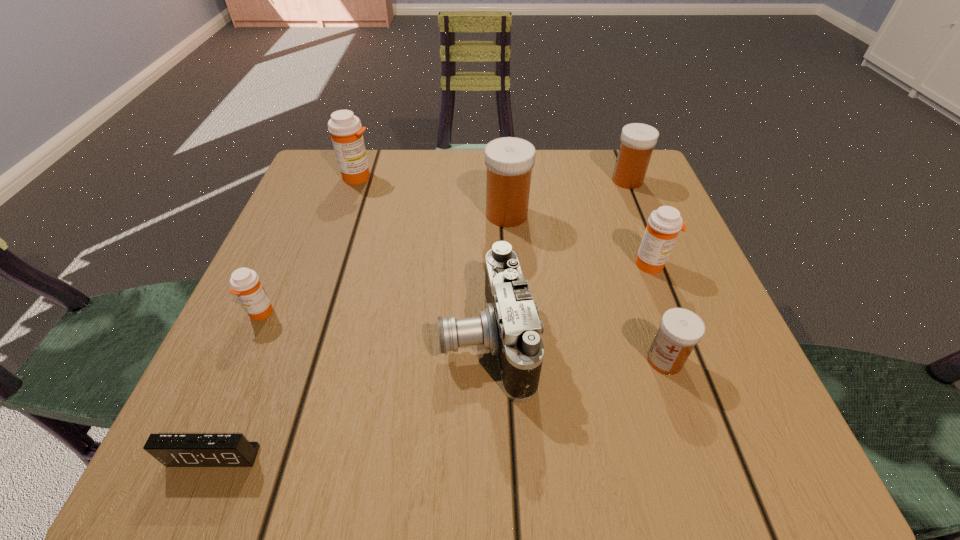
The height and width of the screenshot is (540, 960). In order to click on free space that is in between the leftmost white medicine and the second orange medicine from left to right in this screenshot , I will do `click(433, 195)`.

Find the location of a particular element. The height and width of the screenshot is (540, 960). the seventh closest object relative to the third farthest medicine is located at coordinates (172, 450).

Identify which object is the fourth nearest to the nearest object. Please provide its 2D coordinates. Your answer should be formatted as a tuple, i.e. [(x, y)], where the tuple contains the x and y coordinates of a point satisfying the conditions above.

[(680, 330)]

Identify which medicine is located as the nearest to the nearest medicine. Please provide its 2D coordinates. Your answer should be formatted as a tuple, i.e. [(x, y)], where the tuple contains the x and y coordinates of a point satisfying the conditions above.

[(663, 226)]

The height and width of the screenshot is (540, 960). I want to click on medicine that is the second closest one to the nearest orange medicine, so click(509, 160).

At what (x,y) coordinates should I click in order to perform the action: click on the second closest orange medicine relative to the third nearest medicine. Please return your answer as a coordinate pair (x, y). Looking at the image, I should click on (245, 283).

At what (x,y) coordinates should I click in order to perform the action: click on orange medicine that is the closest to the farthest white medicine. Please return your answer as a coordinate pair (x, y). The width and height of the screenshot is (960, 540). Looking at the image, I should click on (663, 226).

The image size is (960, 540). What are the coordinates of `white medicine that is the third closest to the leftmost medicine` in the screenshot? It's located at (637, 140).

Where is `white medicine identified as the closest to the farthest orange medicine`? The image size is (960, 540). white medicine identified as the closest to the farthest orange medicine is located at coordinates (509, 160).

At what (x,y) coordinates should I click in order to perform the action: click on free space that satisfies the following two spatial constraints: 1. on the front side of the fourth medicine from right to left; 2. at the lens of the camera. Please return your answer as a coordinate pair (x, y). Image resolution: width=960 pixels, height=540 pixels. Looking at the image, I should click on (516, 339).